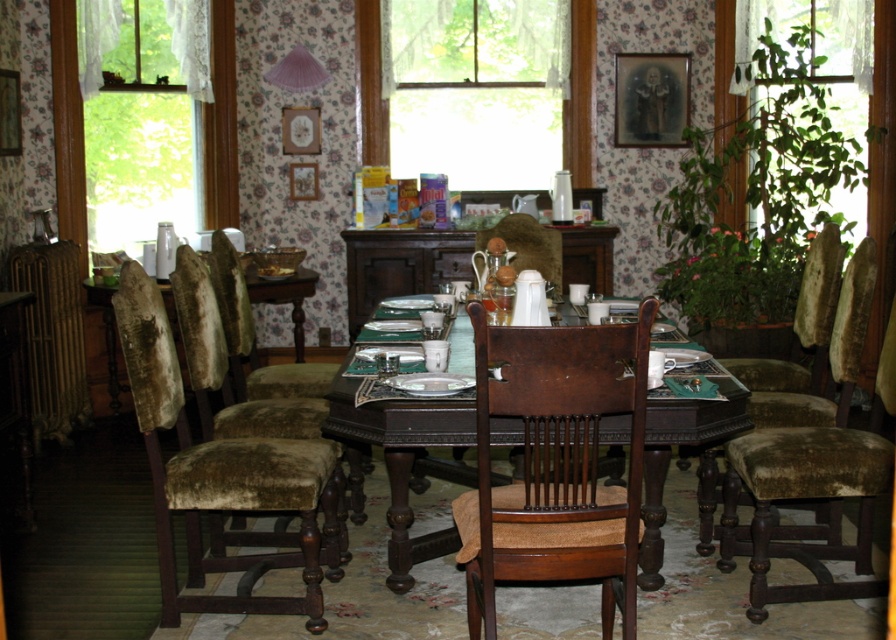
Question: Estimate the real-world distances between objects in this image. Which object is farther from the velvet green armchair at left?

Choices:
 (A) mahogany wood table at center
 (B) velvet green table at left
 (C) mahogany wood chair at center

Answer: (C)

Question: Can you confirm if mahogany wood chair at center is thinner than mahogany wood table at center?

Choices:
 (A) yes
 (B) no

Answer: (A)

Question: Which of the following is the farthest from the observer?

Choices:
 (A) transparent lace curtain at upper left
 (B) green leafy plant at right
 (C) velvet green armchair at left

Answer: (A)

Question: Which of the following is the farthest from the observer?

Choices:
 (A) velvet green chair at lower right
 (B) velvet green chair at left
 (C) matte white porcelain teapot at center
 (D) transparent glass window at center

Answer: (D)

Question: In this image, where is mahogany wood table at center located relative to matte white porcelain teapot at center?

Choices:
 (A) right
 (B) left

Answer: (B)

Question: Can you confirm if velvet green chair at left is smaller than matte white porcelain teapot at center?

Choices:
 (A) no
 (B) yes

Answer: (A)